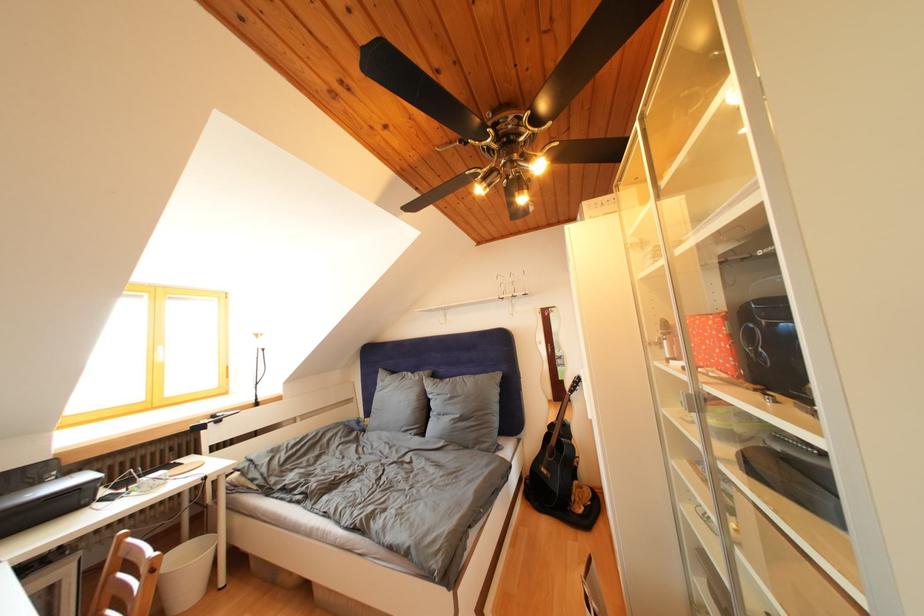
Describe the element at coordinates (512, 151) in the screenshot. Image resolution: width=924 pixels, height=616 pixels. I see `a fan pull chain` at that location.